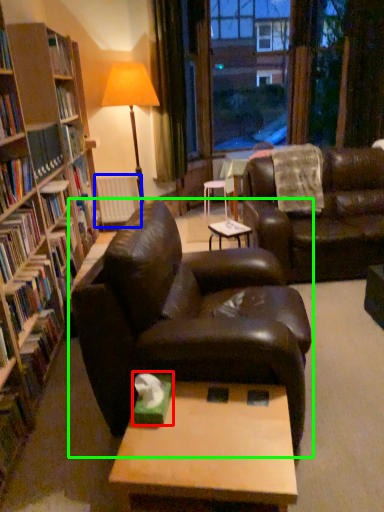
Question: Based on their relative distances, which object is nearer to paperback book (highlighted by a red box)? Choose from radiator (highlighted by a blue box) and studio couch (highlighted by a green box).

Choices:
 (A) radiator
 (B) studio couch

Answer: (B)